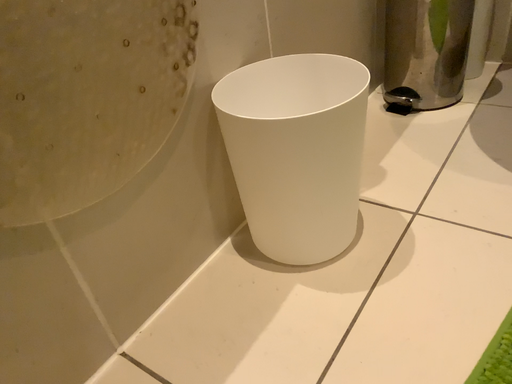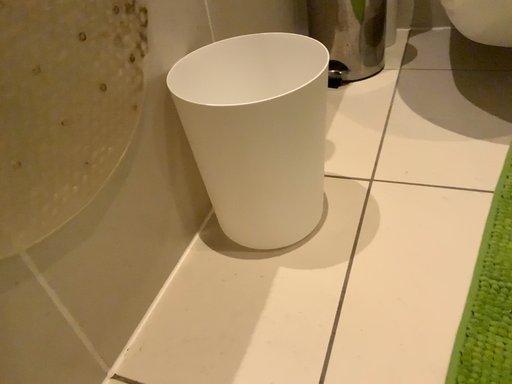
Question: How did the camera likely rotate when shooting the video?

Choices:
 (A) rotated left
 (B) rotated right

Answer: (B)